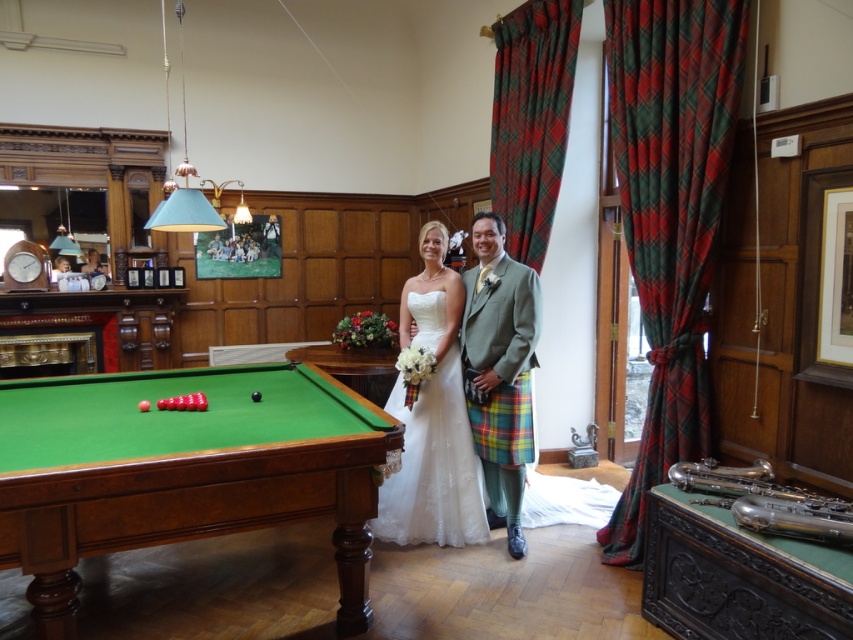
The width and height of the screenshot is (853, 640). What do you see at coordinates (183, 472) in the screenshot? I see `green wood billiard table at lower left` at bounding box center [183, 472].

Can you confirm if green wood billiard table at lower left is positioned above green plaid kilt at center?

Actually, green wood billiard table at lower left is below green plaid kilt at center.

Measure the distance between point (229, 456) and camera.

Point (229, 456) and camera are 7.09 feet apart.

This screenshot has width=853, height=640. In order to click on green wood billiard table at lower left in this screenshot , I will do `click(183, 472)`.

Can you confirm if green wood billiard table at lower left is smaller than white satin dress at center?

Incorrect, green wood billiard table at lower left is not smaller in size than white satin dress at center.

Who is more forward, (71, 387) or (389, 518)?

Point (71, 387)

This screenshot has width=853, height=640. What are the coordinates of `green wood billiard table at lower left` in the screenshot? It's located at (183, 472).

Is point (424, 403) farther from viewer compared to point (482, 413)?

Yes, it is.

Between white satin dress at center and green plaid kilt at center, which one is positioned higher?

green plaid kilt at center is above.

Describe the element at coordinates (432, 419) in the screenshot. This screenshot has width=853, height=640. I see `white satin dress at center` at that location.

This screenshot has width=853, height=640. I want to click on white satin dress at center, so point(432,419).